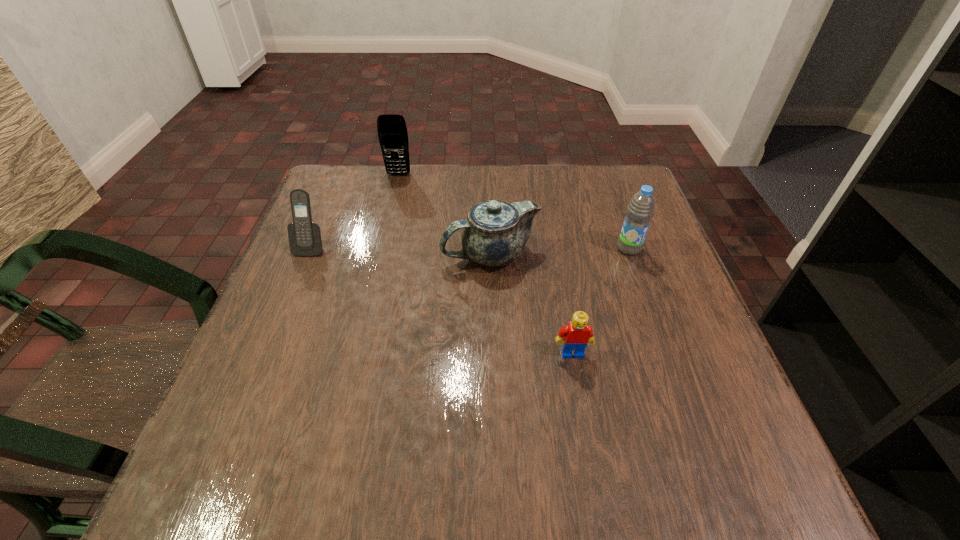
Locate an element on the screen. free space at the left edge is located at coordinates (216, 414).

This screenshot has width=960, height=540. I want to click on vacant space at the right edge of the desktop, so click(660, 254).

Image resolution: width=960 pixels, height=540 pixels. In order to click on free space at the far left corner of the desktop in this screenshot , I will do `click(374, 168)`.

The height and width of the screenshot is (540, 960). Identify the location of free space at the far right corner. (584, 178).

The width and height of the screenshot is (960, 540). What are the coordinates of `free spot between the right cellular telephone and the third object from right to left` in the screenshot? It's located at (444, 214).

At what (x,y) coordinates should I click in order to perform the action: click on unoccupied position between the water bottle and the third object from right to left. Please return your answer as a coordinate pair (x, y). Looking at the image, I should click on (560, 251).

The height and width of the screenshot is (540, 960). I want to click on free spot between the third object from right to left and the second object from right to left, so click(x=531, y=303).

The width and height of the screenshot is (960, 540). I want to click on vacant region between the rightmost object and the Lego, so click(x=601, y=301).

Identify the location of object that ranks as the closest to the chinaware. (641, 208).

Identify the location of object that is the second closest one to the taller cellular telephone. The height and width of the screenshot is (540, 960). pyautogui.click(x=305, y=239).